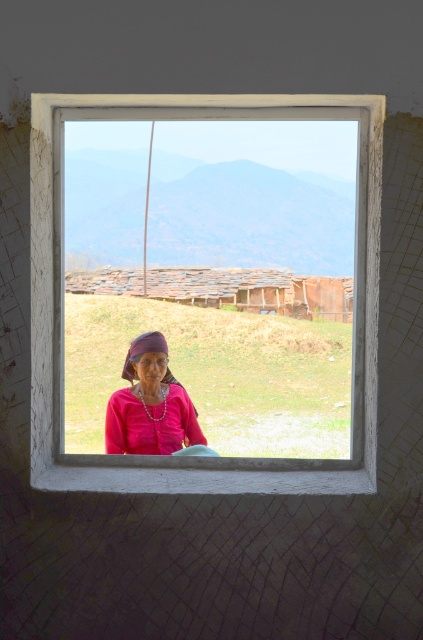
Question: Among these objects, which one is nearest to the camera?

Choices:
 (A) white wooden window frame at center
 (B) matte pink fabric at center

Answer: (A)

Question: Does white wooden window frame at center appear on the left side of matte pink fabric at center?

Choices:
 (A) no
 (B) yes

Answer: (A)

Question: Does white wooden window frame at center appear on the left side of matte pink fabric at center?

Choices:
 (A) no
 (B) yes

Answer: (A)

Question: Which point is closer to the camera?

Choices:
 (A) matte pink fabric at center
 (B) white wooden window frame at center

Answer: (B)

Question: Does white wooden window frame at center have a lesser width compared to matte pink fabric at center?

Choices:
 (A) yes
 (B) no

Answer: (B)